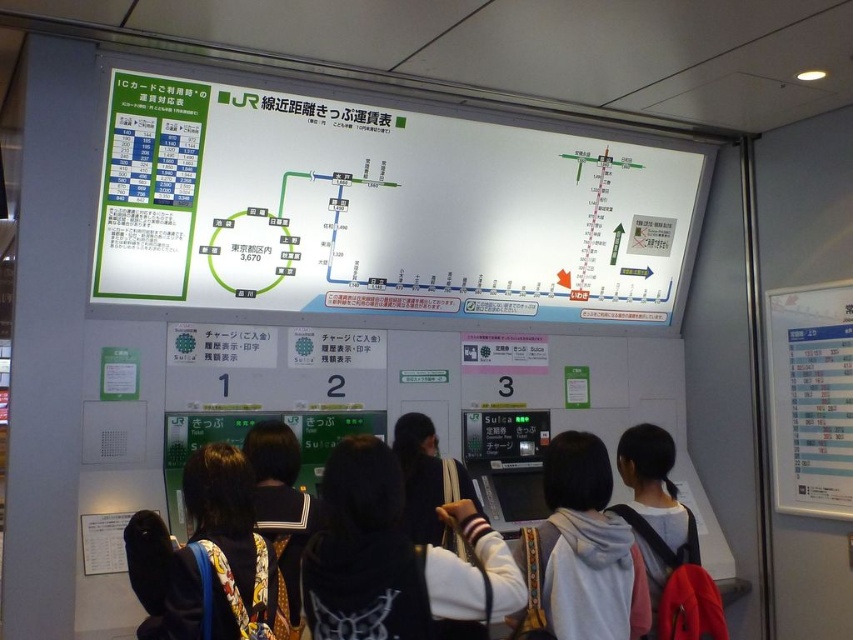
Question: Can you confirm if dark blue backpack at center is positioned above light gray hoodie at center?

Choices:
 (A) no
 (B) yes

Answer: (A)

Question: In this image, where is dark blue backpack at center located relative to white matte hoodie at center?

Choices:
 (A) below
 (B) above

Answer: (B)

Question: Considering the relative positions of white matte hoodie at center and dark blue hoodie at center in the image provided, where is white matte hoodie at center located with respect to dark blue hoodie at center?

Choices:
 (A) right
 (B) left

Answer: (A)

Question: Which point appears closest to the camera in this image?

Choices:
 (A) (143, 278)
 (B) (199, 561)
 (C) (643, 449)

Answer: (B)

Question: Which point appears farthest from the camera in this image?

Choices:
 (A) (636, 516)
 (B) (445, 472)
 (C) (178, 605)

Answer: (B)

Question: Which of the following is the farthest from the observer?

Choices:
 (A) (450, 177)
 (B) (256, 508)
 (C) (386, 547)

Answer: (A)